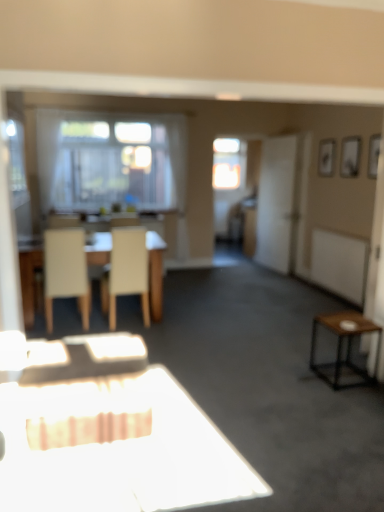
What do you see at coordinates (277, 203) in the screenshot? The width and height of the screenshot is (384, 512). I see `white matte screen door at right` at bounding box center [277, 203].

Where is `beige fabric chair at center, the first chair when ordered from right to left`? The width and height of the screenshot is (384, 512). beige fabric chair at center, the first chair when ordered from right to left is located at coordinates (126, 272).

Is brown wooden side table at right in front of or behind transparent glass window at center in the image?

brown wooden side table at right is positioned closer to the viewer than transparent glass window at center.

From the image's perspective, which one is positioned higher, brown wooden side table at right or transparent glass window at center?

transparent glass window at center appears higher in the image.

Which of these two, brown wooden side table at right or transparent glass window at center, is thinner?

With smaller width is transparent glass window at center.

How many degrees apart are the facing directions of brown wooden side table at right and transparent glass window at center?

87 degrees separate the facing orientations of brown wooden side table at right and transparent glass window at center.

From a real-world perspective, which is physically below, transparent glass window at center or white matte screen door at right?

white matte screen door at right, from a real-world perspective.

Is transparent glass window at center bigger than white matte screen door at right?

Incorrect, transparent glass window at center is not larger than white matte screen door at right.

Is transparent glass window at center touching white matte screen door at right?

No, transparent glass window at center is not making contact with white matte screen door at right.

From the image's perspective, which is above, transparent glass window at center or white matte screen door at right?

transparent glass window at center.

How much distance is there between light beige wood table at center and brown wooden side table at right?

They are 2.65 meters apart.

Would you say light beige wood table at center is a long distance from brown wooden side table at right?

Absolutely, light beige wood table at center is distant from brown wooden side table at right.

Could brown wooden side table at right be considered to be inside light beige wood table at center?

Definitely not — brown wooden side table at right is not inside light beige wood table at center.

Is light beige wood table at center positioned with its back to brown wooden side table at right?

light beige wood table at center is not turned away from brown wooden side table at right.

Which is more to the left, beige fabric chair at center, the first chair when ordered from right to left, or light beige wood table at center?

light beige wood table at center.

Between point (143, 261) and point (92, 262), which one is positioned behind?

The point (92, 262) is farther.

Is beige fabric chair at center, the first chair when ordered from right to left, not within light beige wood table at center?

No, beige fabric chair at center, the first chair when ordered from right to left, is inside or overlapping with light beige wood table at center.

How much distance is there between beige fabric chair at center, which ranks as the second chair in left-to-right order, and light beige wood table at center?

beige fabric chair at center, which ranks as the second chair in left-to-right order, and light beige wood table at center are 35.23 inches apart from each other.

In the scene shown: Are white matte screen door at right and light beige wood table at center making contact?

No, white matte screen door at right is not beside light beige wood table at center.

This screenshot has width=384, height=512. Identify the location of table in front of the white matte screen door at right. (29, 277).

Consider the image. Is white matte screen door at right in front of or behind light beige wood table at center in the image?

white matte screen door at right is behind light beige wood table at center.

Which of these two, white matte screen door at right or light beige wood table at center, is thinner?

Thinner between the two is white matte screen door at right.

Looking at this image, how many degrees apart are the facing directions of brown wooden side table at right and white matte chair at left, which appears as the second chair when viewed from the right?

The angular difference between brown wooden side table at right and white matte chair at left, which appears as the second chair when viewed from the right, is 90.5 degrees.

From the picture: Based on their positions, is brown wooden side table at right located to the left or right of white matte chair at left, which appears as the second chair when viewed from the right?

Clearly, brown wooden side table at right is on the right of white matte chair at left, which appears as the second chair when viewed from the right, in the image.

Considering the relative sizes of brown wooden side table at right and white matte chair at left, which appears as the second chair when viewed from the right, in the image provided, is brown wooden side table at right smaller than white matte chair at left, which appears as the second chair when viewed from the right,?

Indeed, brown wooden side table at right has a smaller size compared to white matte chair at left, which appears as the second chair when viewed from the right.

From the image's perspective, which object appears higher, brown wooden side table at right or white matte chair at left, marked as the first chair in a left-to-right arrangement?

white matte chair at left, marked as the first chair in a left-to-right arrangement, is shown above in the image.

From a real-world perspective, who is located higher, white matte chair at left, which appears as the second chair when viewed from the right, or transparent glass window at center?

From a 3D spatial view, transparent glass window at center is above.

Based on the photo, is transparent glass window at center inside white matte chair at left, which appears as the second chair when viewed from the right?

No, transparent glass window at center is not surrounded by white matte chair at left, which appears as the second chair when viewed from the right.

From the image's perspective, is white matte chair at left, marked as the first chair in a left-to-right arrangement, located beneath transparent glass window at center?

Yes.

Does white matte chair at left, which appears as the second chair when viewed from the right, have a greater height compared to transparent glass window at center?

In fact, white matte chair at left, which appears as the second chair when viewed from the right, may be shorter than transparent glass window at center.

Identify the location of side table lying on the right of transparent glass window at center. (342, 346).

Locate an element on the screen. This screenshot has height=512, width=384. screen door in front of the transparent glass window at center is located at coordinates (277, 203).

When comparing their distances from brown wooden side table at right, does beige fabric chair at center, which ranks as the second chair in left-to-right order, or white matte screen door at right seem further?

The object further to brown wooden side table at right is white matte screen door at right.

Based on their spatial positions, is light beige wood table at center or white matte chair at left, marked as the first chair in a left-to-right arrangement, closer to transparent glass window at center?

Based on the image, light beige wood table at center appears to be nearer to transparent glass window at center.

Which object lies nearer to the anchor point transparent glass window at center, brown wooden side table at right or white matte screen door at right?

Based on the image, white matte screen door at right appears to be nearer to transparent glass window at center.

Based on their spatial positions, is light beige wood table at center or beige fabric chair at center, which ranks as the second chair in left-to-right order, further from transparent glass window at center?

light beige wood table at center is positioned further to the anchor transparent glass window at center.

Looking at the image, which one is located further to light beige wood table at center, white matte chair at left, which appears as the second chair when viewed from the right, or beige fabric chair at center, which ranks as the second chair in left-to-right order?

Among the two, beige fabric chair at center, which ranks as the second chair in left-to-right order, is located further to light beige wood table at center.

Based on the photo, considering their positions, is light beige wood table at center positioned further to white matte screen door at right than white matte chair at left, which appears as the second chair when viewed from the right?

Based on the image, light beige wood table at center appears to be further to white matte screen door at right.

Which object lies nearer to the anchor point white matte screen door at right, transparent glass window at center or beige fabric chair at center, which ranks as the second chair in left-to-right order?

transparent glass window at center is positioned closer to the anchor white matte screen door at right.

Based on their spatial positions, is beige fabric chair at center, the first chair when ordered from right to left, or transparent glass window at center closer to light beige wood table at center?

Among the two, beige fabric chair at center, the first chair when ordered from right to left, is located nearer to light beige wood table at center.

Image resolution: width=384 pixels, height=512 pixels. I want to click on chair situated between white matte chair at left, marked as the first chair in a left-to-right arrangement, and white matte screen door at right from left to right, so click(x=126, y=272).

The width and height of the screenshot is (384, 512). In order to click on chair located between light beige wood table at center and brown wooden side table at right in the left-right direction in this screenshot , I will do `click(126, 272)`.

Find the location of a particular element. table between white matte chair at left, marked as the first chair in a left-to-right arrangement, and transparent glass window at center in the front-back direction is located at coordinates pos(29,277).

At what (x,y) coordinates should I click in order to perform the action: click on table located between brown wooden side table at right and white matte screen door at right in the depth direction. Please return your answer as a coordinate pair (x, y). This screenshot has width=384, height=512. Looking at the image, I should click on (29, 277).